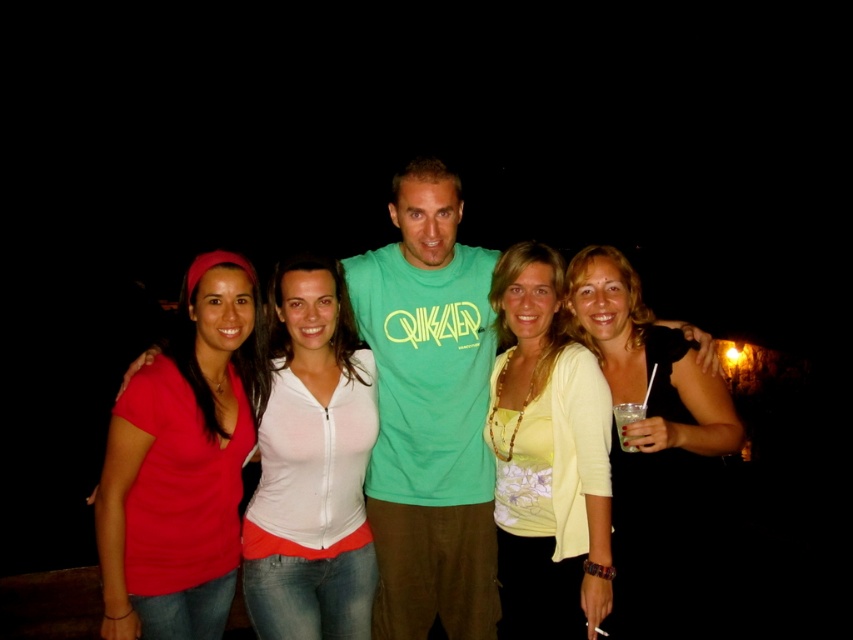
Is green matte t-shirt at center above clear plastic cup at center right?

Correct, green matte t-shirt at center is located above clear plastic cup at center right.

Find the location of a particular element. The image size is (853, 640). green matte t-shirt at center is located at coordinates (426, 214).

Who is more forward, (x=413, y=173) or (x=624, y=435)?

Point (x=624, y=435) is more forward.

Identify the location of green matte t-shirt at center. The image size is (853, 640). (426, 214).

I want to click on black matte dress at right, so click(653, 444).

Who is taller, black matte dress at right or green matte t-shirt at center?

green matte t-shirt at center is taller.

The image size is (853, 640). Identify the location of black matte dress at right. (653, 444).

You are a GUI agent. You are given a task and a screenshot of the screen. Output one action in this format:
    pyautogui.click(x=<x>, y=<y>)
    Task: Click on the black matte dress at right
    
    Given the screenshot: What is the action you would take?
    pyautogui.click(x=653, y=444)

Between yellow fabric top at center and matte red shirt at center, which one is positioned higher?

Positioned higher is yellow fabric top at center.

Which is in front, point (572, 580) or point (322, 560)?

Point (572, 580) is in front.

Locate an element on the screen. yellow fabric top at center is located at coordinates (547, 458).